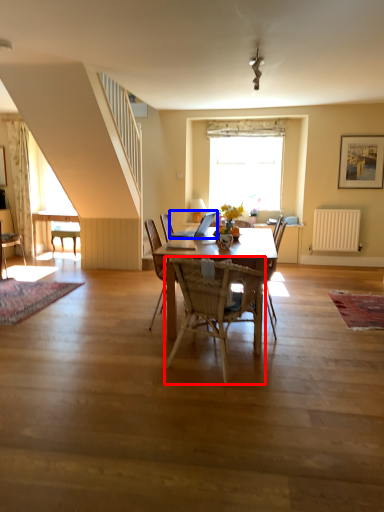
Question: Which object is closer to the camera taking this photo, chair (highlighted by a red box) or laptop (highlighted by a blue box)?

Choices:
 (A) chair
 (B) laptop

Answer: (A)